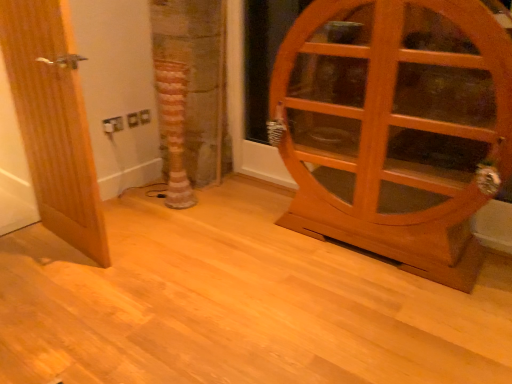
Question: Is striped fabric tree trunk at center shorter than wooden cabinet at right, acting as the 1th door starting from the right?

Choices:
 (A) yes
 (B) no

Answer: (A)

Question: Is striped fabric tree trunk at center bigger than wooden cabinet at right, placed as the second door when sorted from left to right?

Choices:
 (A) no
 (B) yes

Answer: (A)

Question: From a real-world perspective, is striped fabric tree trunk at center under wooden cabinet at right, acting as the 1th door starting from the right?

Choices:
 (A) yes
 (B) no

Answer: (A)

Question: From the image's perspective, is striped fabric tree trunk at center on wooden cabinet at right, acting as the 1th door starting from the right?

Choices:
 (A) yes
 (B) no

Answer: (A)

Question: Is striped fabric tree trunk at center to the right of wooden cabinet at right, acting as the 1th door starting from the right, from the viewer's perspective?

Choices:
 (A) no
 (B) yes

Answer: (A)

Question: Does striped fabric tree trunk at center come in front of wooden cabinet at right, placed as the second door when sorted from left to right?

Choices:
 (A) yes
 (B) no

Answer: (B)

Question: Are wooden door at left, which is counted as the 1th door, starting from the left, and striped fabric tree trunk at center beside each other?

Choices:
 (A) yes
 (B) no

Answer: (B)

Question: Is wooden door at left, the 2th door from the right, facing away from striped fabric tree trunk at center?

Choices:
 (A) no
 (B) yes

Answer: (B)

Question: Is wooden door at left, the 2th door from the right, further to camera compared to striped fabric tree trunk at center?

Choices:
 (A) no
 (B) yes

Answer: (A)

Question: Is wooden door at left, which is counted as the 1th door, starting from the left, thinner than striped fabric tree trunk at center?

Choices:
 (A) yes
 (B) no

Answer: (A)

Question: From a real-world perspective, is wooden door at left, the 2th door from the right, physically below striped fabric tree trunk at center?

Choices:
 (A) yes
 (B) no

Answer: (B)

Question: Is wooden door at left, the 2th door from the right, oriented towards striped fabric tree trunk at center?

Choices:
 (A) no
 (B) yes

Answer: (B)

Question: Are wooden cabinet at right, acting as the 1th door starting from the right, and striped fabric tree trunk at center making contact?

Choices:
 (A) yes
 (B) no

Answer: (B)